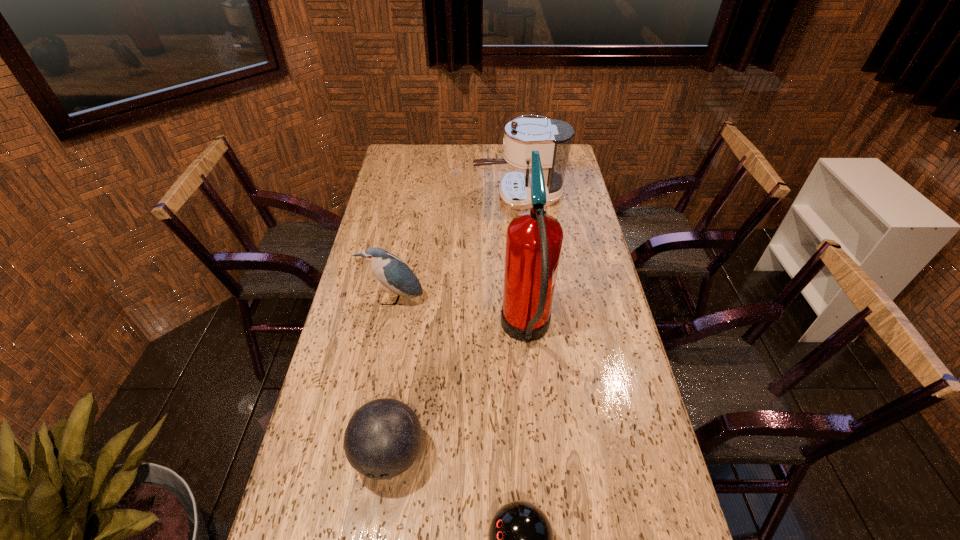
Find the location of a particular element. This screenshot has height=540, width=960. the tallest object is located at coordinates (534, 239).

Identify the location of coffee maker. click(552, 138).

At what (x,y) coordinates should I click in order to perform the action: click on the fourth shortest object. Please return your answer as a coordinate pair (x, y). The image size is (960, 540). Looking at the image, I should click on (552, 138).

The image size is (960, 540). I want to click on bird, so click(x=390, y=270).

Identify the location of the left bowling ball. This screenshot has width=960, height=540. (383, 438).

Locate an element on the screen. the second nearest object is located at coordinates (383, 438).

Where is `vacant space located on the back of the tallest object`? This screenshot has height=540, width=960. vacant space located on the back of the tallest object is located at coordinates (519, 264).

Find the location of a particular element. Image resolution: width=960 pixels, height=540 pixels. vacant space situated on the front-facing side of the second tallest object is located at coordinates (452, 197).

Where is `free point located 0.150m on the front-facing side of the second tallest object`? The image size is (960, 540). free point located 0.150m on the front-facing side of the second tallest object is located at coordinates (438, 197).

I want to click on vacant area situated 0.130m on the front-facing side of the second tallest object, so click(443, 197).